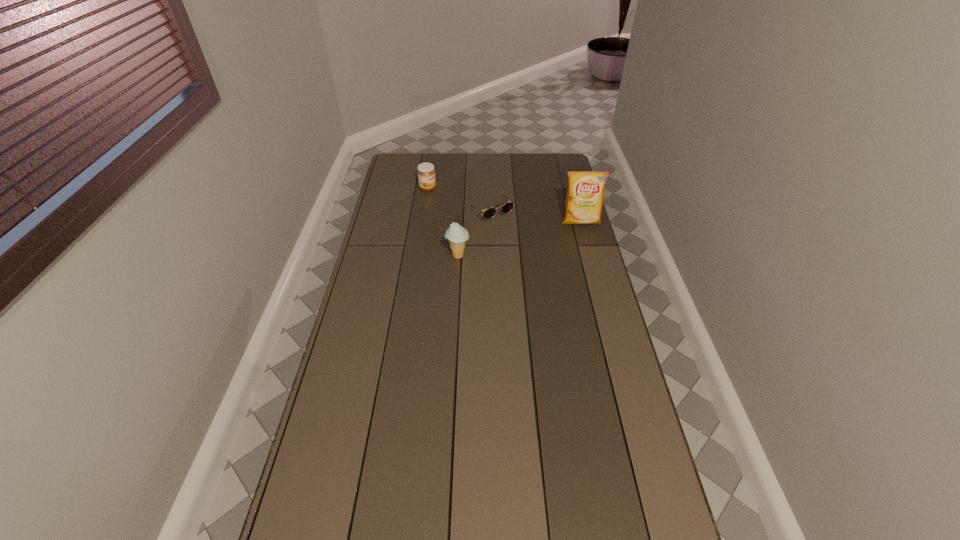
Find the location of a particular element. Image resolution: width=960 pixels, height=540 pixels. the second tallest object is located at coordinates (457, 235).

Where is `the nearest object`? The image size is (960, 540). the nearest object is located at coordinates (457, 235).

You are a GUI agent. You are given a task and a screenshot of the screen. Output one action in this format:
    pyautogui.click(x=<x>, y=<y>)
    Task: Click on the rightmost object
    The height and width of the screenshot is (540, 960).
    Given the screenshot: What is the action you would take?
    pyautogui.click(x=585, y=194)

The width and height of the screenshot is (960, 540). Find the location of `the tallest object`. the tallest object is located at coordinates (585, 194).

Where is `the second shortest object`? This screenshot has width=960, height=540. the second shortest object is located at coordinates (x=426, y=173).

This screenshot has height=540, width=960. I want to click on jam, so click(426, 173).

Locate an element on the screen. This screenshot has width=960, height=540. the shortest object is located at coordinates (488, 213).

Find the location of a particular element. This screenshot has width=960, height=540. vacant position located 0.380m on the right of the third shortest object is located at coordinates (564, 256).

Identify the location of vacant space located 0.190m on the front-facing side of the crisp (potato chip). (590, 258).

Locate an element on the screen. The width and height of the screenshot is (960, 540). vacant space located on the front label of the farthest object is located at coordinates [453, 200].